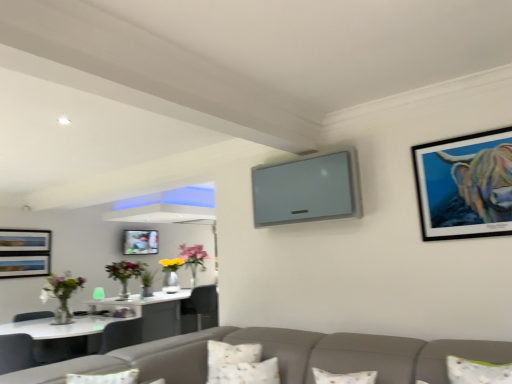
Question: Considering the relative positions of metallic black frame at upper right, which is the first picture frame from right to left, and metallic silver picture frame at center, positioned as the 2th picture frame in front-to-back order, in the image provided, is metallic black frame at upper right, which is the first picture frame from right to left, behind metallic silver picture frame at center, positioned as the 2th picture frame in front-to-back order,?

Choices:
 (A) no
 (B) yes

Answer: (A)

Question: Does metallic black frame at upper right, positioned as the 2th picture frame in back-to-front order, appear on the right side of metallic silver picture frame at center, which ranks as the 1th picture frame in left-to-right order?

Choices:
 (A) yes
 (B) no

Answer: (A)

Question: Is metallic black frame at upper right, which is the first picture frame from top to bottom, aimed at metallic silver picture frame at center, placed as the second picture frame when sorted from top to bottom?

Choices:
 (A) yes
 (B) no

Answer: (B)

Question: Is the surface of metallic black frame at upper right, the 2th picture frame in the bottom-to-top sequence, in direct contact with metallic silver picture frame at center, the first picture frame positioned from the back?

Choices:
 (A) no
 (B) yes

Answer: (A)

Question: Does metallic black frame at upper right, positioned as the 2th picture frame in back-to-front order, have a lesser height compared to metallic silver picture frame at center, the first picture frame positioned from the back?

Choices:
 (A) yes
 (B) no

Answer: (B)

Question: Based on their positions, is metallic silver picture frame at center, the first picture frame positioned from the back, located to the left or right of white textured pillow at lower center, the 2th pillow in the front-to-back sequence?

Choices:
 (A) left
 (B) right

Answer: (A)

Question: Is metallic silver picture frame at center, which ranks as the 1th picture frame in left-to-right order, inside or outside of white textured pillow at lower center, the 2th pillow in the front-to-back sequence?

Choices:
 (A) outside
 (B) inside

Answer: (A)

Question: Based on their sizes in the image, would you say metallic silver picture frame at center, positioned as the 2th picture frame in front-to-back order, is bigger or smaller than white textured pillow at lower center, the 2th pillow in the front-to-back sequence?

Choices:
 (A) big
 (B) small

Answer: (B)

Question: Does point [144, 236] appear closer or farther from the camera than point [217, 362]?

Choices:
 (A) farther
 (B) closer

Answer: (A)

Question: Does point (429, 198) appear closer or farther from the camera than point (132, 266)?

Choices:
 (A) closer
 (B) farther

Answer: (A)

Question: Considering the positions of metallic black frame at upper right, which is the first picture frame from right to left, and translucent glass vase with flowers at left, which is counted as the first floral arrangement, starting from the left, in the image, is metallic black frame at upper right, which is the first picture frame from right to left, wider or thinner than translucent glass vase with flowers at left, which is counted as the first floral arrangement, starting from the left,?

Choices:
 (A) thin
 (B) wide

Answer: (A)

Question: Visually, is metallic black frame at upper right, the 2th picture frame in the bottom-to-top sequence, positioned to the left or to the right of translucent glass vase with flowers at left, marked as the second floral arrangement in a back-to-front arrangement?

Choices:
 (A) left
 (B) right

Answer: (B)

Question: From a real-world perspective, is metallic black frame at upper right, the 2th picture frame in the bottom-to-top sequence, positioned above or below translucent glass vase with flowers at left, marked as the second floral arrangement in a back-to-front arrangement?

Choices:
 (A) above
 (B) below

Answer: (A)

Question: Considering their positions, is metallic black frame at upper right, positioned as the 2th picture frame in back-to-front order, located in front of or behind white textured pillow at lower center, acting as the second pillow starting from the back?

Choices:
 (A) front
 (B) behind

Answer: (A)

Question: Based on their positions, is metallic black frame at upper right, the first picture frame from the front, located to the left or right of white textured pillow at lower center, acting as the second pillow starting from the back?

Choices:
 (A) right
 (B) left

Answer: (A)